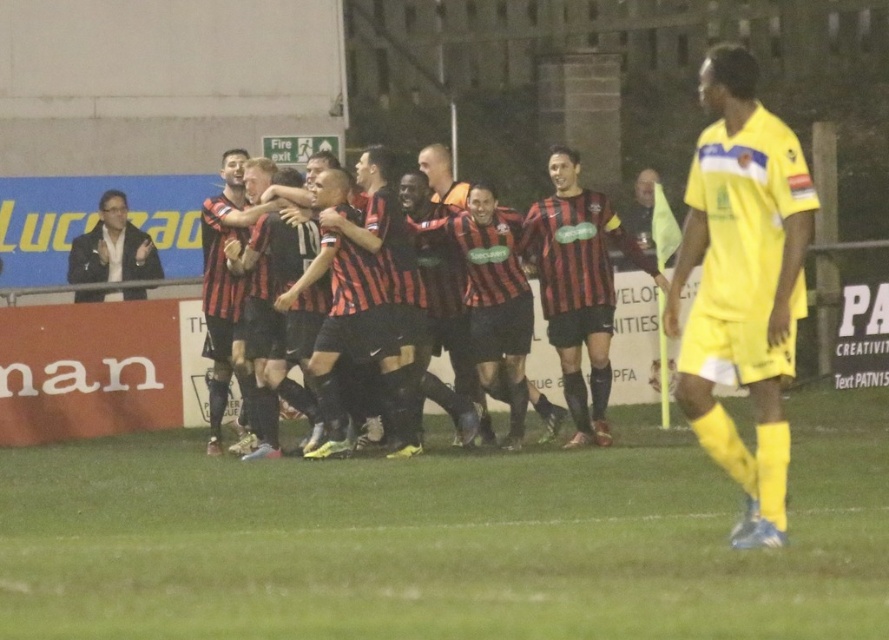
Question: Which is nearer to the black leather jacket at left?

Choices:
 (A) yellow jersey at right
 (B) green grass at center

Answer: (B)

Question: Which of the following is the closest to the observer?

Choices:
 (A) red and black striped jersey at center
 (B) green grass at center
 (C) black leather jacket at left
 (D) striped jersey at center

Answer: (B)

Question: Estimate the real-world distances between objects in this image. Which object is farther from the striped jersey at center?

Choices:
 (A) black leather jacket at left
 (B) yellow jersey at right
 (C) red and black striped jersey at center

Answer: (B)

Question: Does yellow jersey at right appear on the left side of red and black striped jersey at center?

Choices:
 (A) yes
 (B) no

Answer: (B)

Question: Observing the image, what is the correct spatial positioning of green grass at center in reference to black leather jacket at left?

Choices:
 (A) left
 (B) right

Answer: (B)

Question: Can you confirm if striped jersey at center is smaller than black leather jacket at left?

Choices:
 (A) no
 (B) yes

Answer: (A)